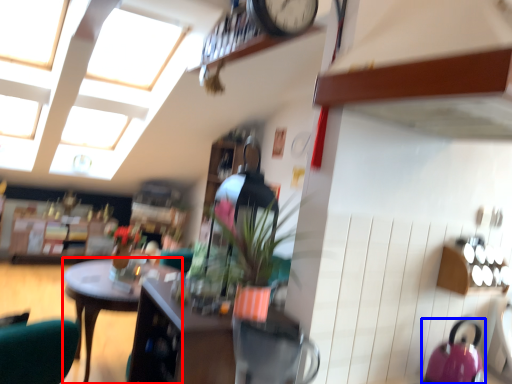
Question: Which point is further to the camera, desk (highlighted by a red box) or kettle (highlighted by a blue box)?

Choices:
 (A) desk
 (B) kettle

Answer: (A)